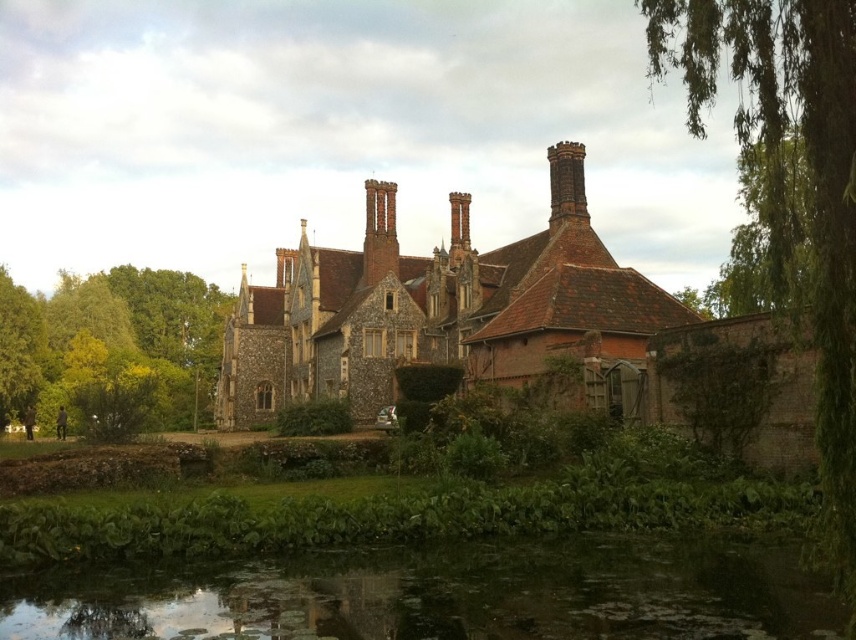
You are a drone operator tasked with capturing aerial footage of the historic manor house. Your drone has a maximum flight range of 60 meters. You need to fly from the green mossy water at lower center to the smooth brick chimney at center to get the best shot. Can your drone complete this flight without exceeding its range?

The distance between the green mossy water at lower center and the smooth brick chimney at center is 65.95 meters, which exceeds the drone operator drone maximum flight range of 60 meters. Therefore, the drone cannot complete the flight without exceeding its range.

You are standing at point (113,348) in the image. Looking around, you see a green leafy tree at lower left. Which direction should you face to look towards the green leafy tree at lower left?

You should face towards the lower left direction to look towards the green leafy tree at lower left located at point (113,348).